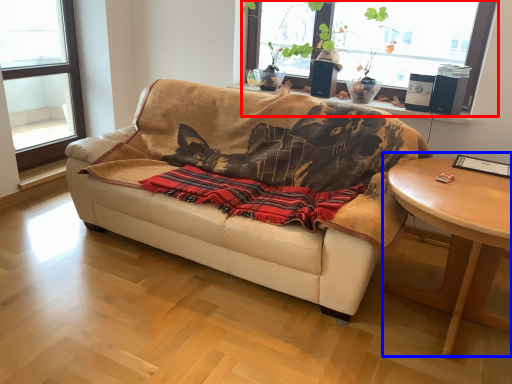
Question: Which of the following is the farthest to the observer, window (highlighted by a red box) or coffee table (highlighted by a blue box)?

Choices:
 (A) window
 (B) coffee table

Answer: (A)